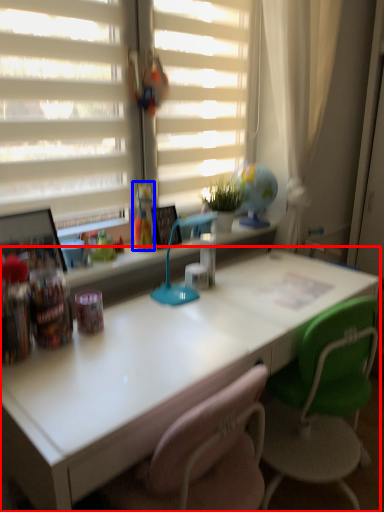
Question: Which object appears farthest to the camera in this image, desk (highlighted by a red box) or toy (highlighted by a blue box)?

Choices:
 (A) desk
 (B) toy

Answer: (B)